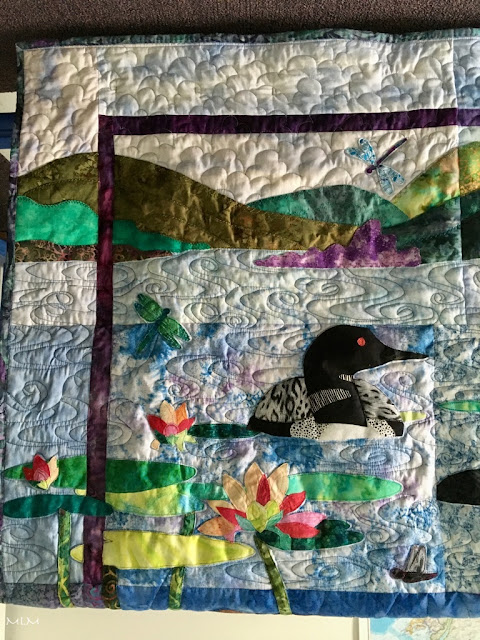
Locate an element on the screen. The width and height of the screenshot is (480, 640). red flower petals on flower on quilt is located at coordinates pos(260,492), pos(292,502), pos(297,528), pos(226,513).